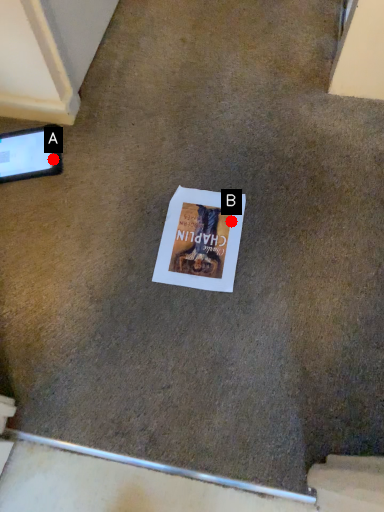
Question: Two points are circled on the image, labeled by A and B beside each circle. Among these points, which one is farthest from the camera?

Choices:
 (A) A is further
 (B) B is further

Answer: (A)